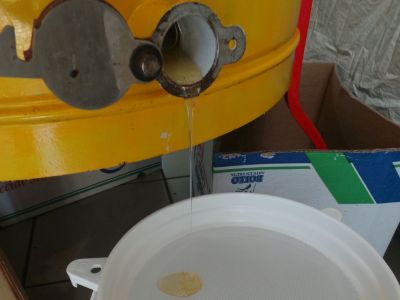
Find the location of a particular element. The height and width of the screenshot is (300, 400). cardbored box is located at coordinates (351, 118).